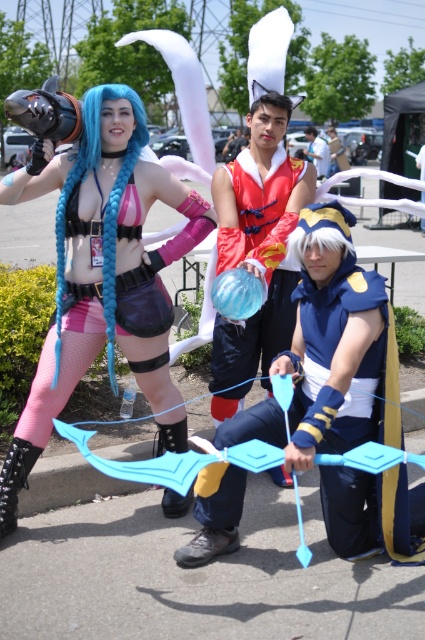
Does matte blue hair at center have a greater width compared to shiny red fabric dress at center?

Yes, matte blue hair at center is wider than shiny red fabric dress at center.

Who is more distant from viewer, (67, 368) or (294, 163)?

The point (294, 163) is behind.

Find the location of `matte blue hair at center`. matte blue hair at center is located at coordinates click(102, 275).

Can you confirm if blue fabric bow at center is positioned to the right of shiny red fabric dress at center?

Correct, you'll find blue fabric bow at center to the right of shiny red fabric dress at center.

Is blue fabric bow at center further to camera compared to shiny red fabric dress at center?

No, blue fabric bow at center is in front of shiny red fabric dress at center.

What are the coordinates of `blue fabric bow at center` in the screenshot? It's located at (333, 340).

Can you confirm if matte blue hair at center is positioned above blue fabric bow at center?

Correct, matte blue hair at center is located above blue fabric bow at center.

Consider the image. Does matte blue hair at center come in front of blue fabric bow at center?

No.

Consider the image. Who is more forward, (181, 256) or (246, 417)?

Positioned in front is point (246, 417).

At what (x,y) coordinates should I click in order to perform the action: click on matte blue hair at center. Please return your answer as a coordinate pair (x, y). The height and width of the screenshot is (640, 425). Looking at the image, I should click on (102, 275).